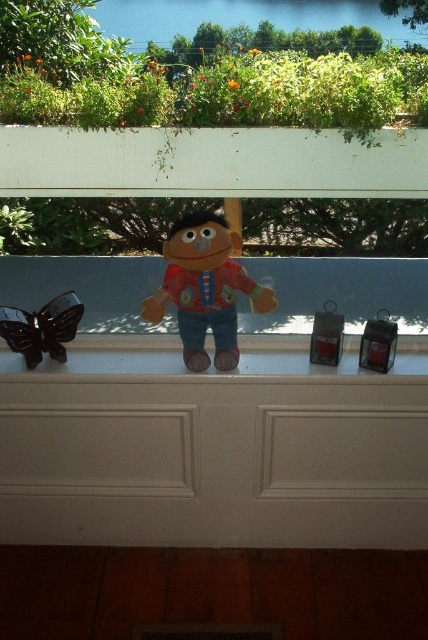
Question: Among these objects, which one is farthest from the camera?

Choices:
 (A) white matte ledge at center
 (B) glossy plastic butterfly at left
 (C) matte brown plush at center

Answer: (A)

Question: Is matte brown plush at center closer to the viewer compared to glossy plastic butterfly at left?

Choices:
 (A) no
 (B) yes

Answer: (B)

Question: Can you confirm if white matte ledge at center is positioned below matte brown plush at center?

Choices:
 (A) no
 (B) yes

Answer: (B)

Question: Which point is farther from the camera taking this photo?

Choices:
 (A) (5, 326)
 (B) (309, 428)
 (C) (232, 244)

Answer: (B)

Question: Is matte brown plush at center below glossy plastic butterfly at left?

Choices:
 (A) no
 (B) yes

Answer: (A)

Question: Among these objects, which one is farthest from the camera?

Choices:
 (A) white matte ledge at center
 (B) glossy plastic butterfly at left

Answer: (A)